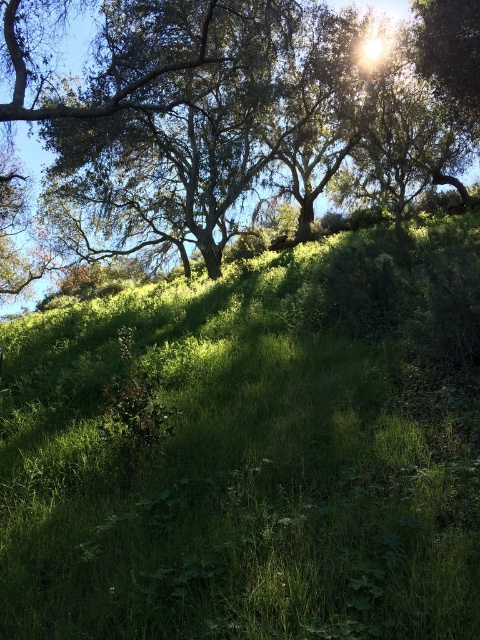
Is green grassy hillside at upper center shorter than green leafy tree at upper left?

Correct, green grassy hillside at upper center is not as tall as green leafy tree at upper left.

Is green grassy hillside at upper center above green leafy tree at upper left?

No, green grassy hillside at upper center is not above green leafy tree at upper left.

Is point (231, 589) in front of point (17, 298)?

Yes.

Where is `green grassy hillside at upper center`? Image resolution: width=480 pixels, height=640 pixels. green grassy hillside at upper center is located at coordinates (254, 452).